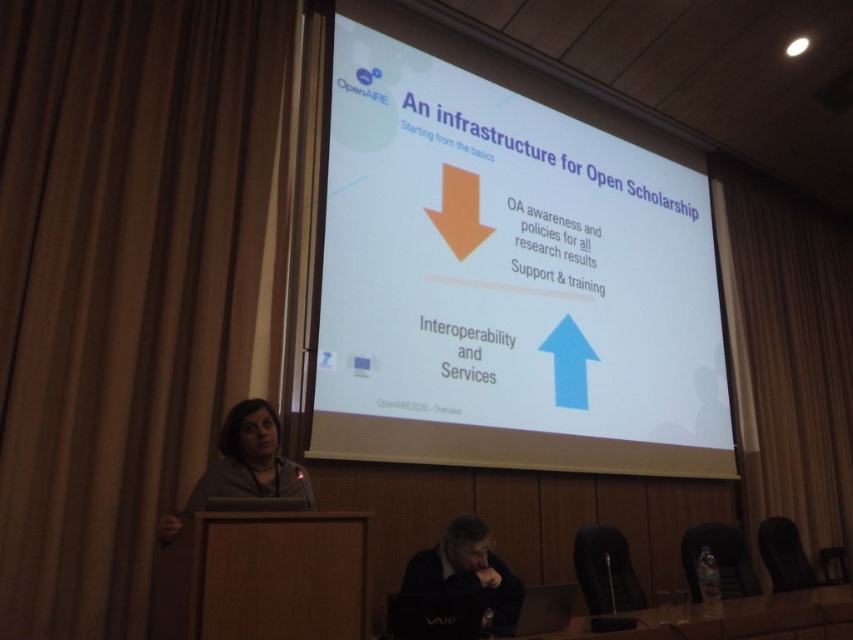
Can you confirm if wooden table at lower center is shorter than dark gray sweater at lower center?

No.

In the scene shown: Who is positioned more to the right, wooden table at lower center or dark gray sweater at lower center?

From the viewer's perspective, dark gray sweater at lower center appears more on the right side.

Find the location of a particular element. This screenshot has width=853, height=640. wooden table at lower center is located at coordinates (279, 576).

Which is more to the right, clear plastic water bottle at lower right or dark gray sweater at lower center?

From the viewer's perspective, clear plastic water bottle at lower right appears more on the right side.

From the picture: Is clear plastic water bottle at lower right above dark gray sweater at lower center?

Actually, clear plastic water bottle at lower right is below dark gray sweater at lower center.

Does point (801, 595) come closer to viewer compared to point (491, 596)?

No, (801, 595) is behind (491, 596).

Identify the location of clear plastic water bottle at lower right. (738, 620).

Does white matte projector screen at center appear on the right side of clear plastic water bottle at lower right?

No, white matte projector screen at center is not to the right of clear plastic water bottle at lower right.

Does point (403, 412) lie behind point (643, 611)?

That is True.

What do you see at coordinates (508, 272) in the screenshot? I see `white matte projector screen at center` at bounding box center [508, 272].

Locate an element on the screen. The height and width of the screenshot is (640, 853). white matte projector screen at center is located at coordinates (508, 272).